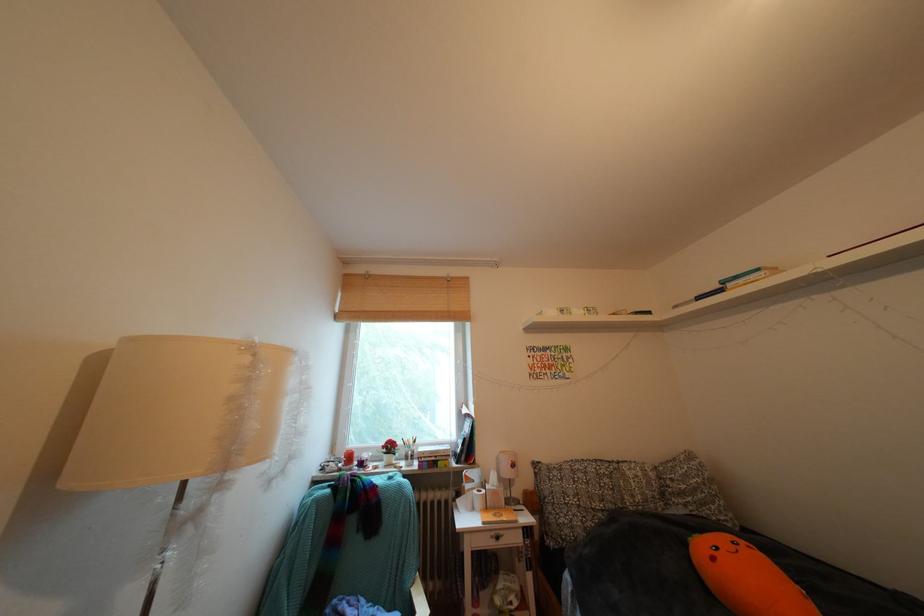
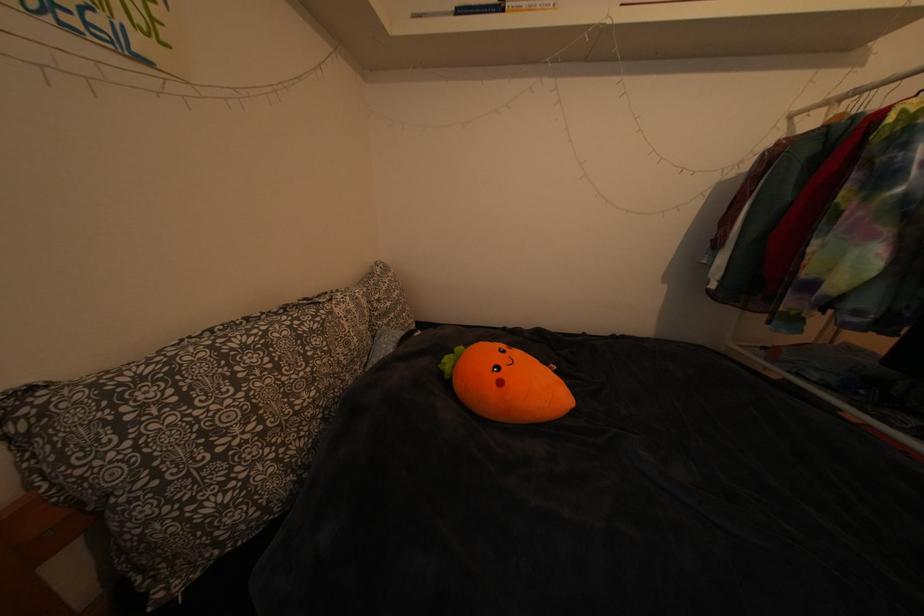
Where in the second image is the point corresponding to pixel 647 482 from the first image?

(359, 317)